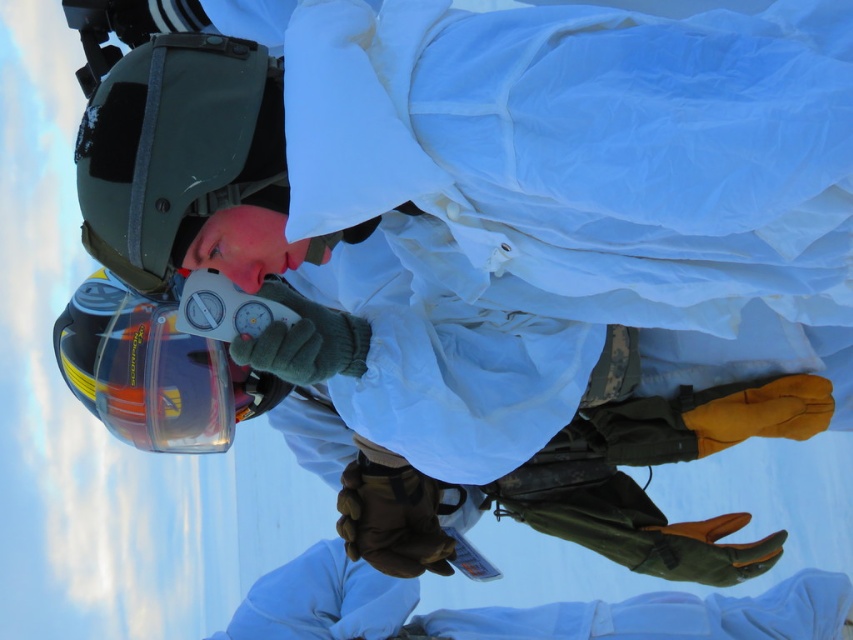
Question: Does matte white snowboard at center have a lesser width compared to matte green glove at center?

Choices:
 (A) yes
 (B) no

Answer: (A)

Question: Observing the image, what is the correct spatial positioning of matte white snowboard at center in reference to matte green glove at center?

Choices:
 (A) left
 (B) right

Answer: (A)

Question: Estimate the real-world distances between objects in this image. Which object is closer to the glossy black helmet at upper left?

Choices:
 (A) translucent orange helmet at lower left
 (B) matte white snowboard at center
 (C) matte green glove at center

Answer: (A)

Question: Which object appears closest to the camera in this image?

Choices:
 (A) translucent orange helmet at lower left
 (B) glossy black helmet at upper left
 (C) matte green glove at center

Answer: (B)

Question: Which point appears closest to the camera in this image?

Choices:
 (A) (579, 620)
 (B) (250, 186)

Answer: (B)

Question: Does matte green glove at center appear under translucent orange helmet at lower left?

Choices:
 (A) yes
 (B) no

Answer: (A)